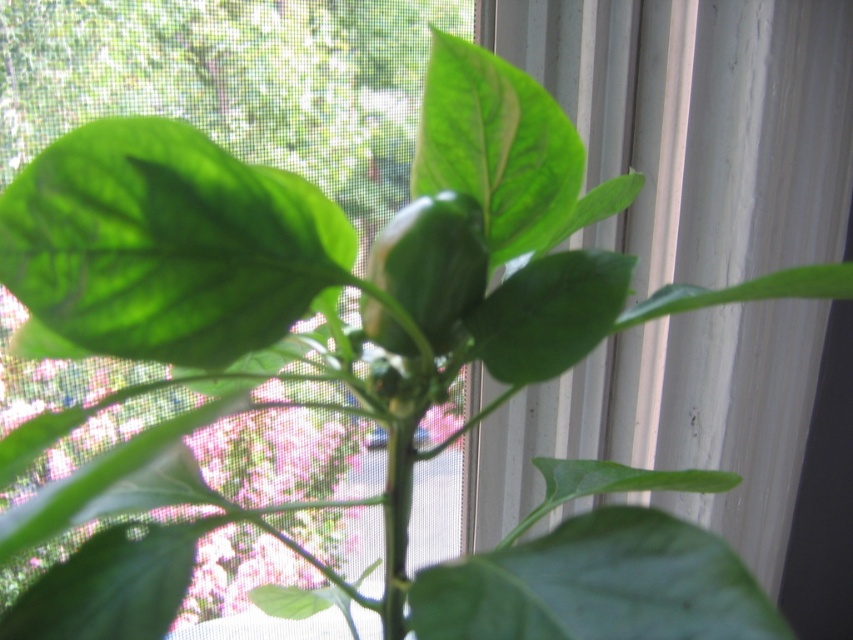
You are a gardener who needs to measure the space between two leaves on a pepper plant. You have a ruler that can measure up to 2 inches. Can you accurately measure the gap between the green matte leaf at upper center and the green matte leaf at center?

The gap between the green matte leaf at upper center and the green matte leaf at center is 2.32 inches, which exceeds the ruler length of 2 inches. Therefore, the ruler cannot accurately measure the entire distance between them.

You are a botanist examining the green pepper plant. You need to locate the green matte leaf at upper center. Where is it positioned in the image?

The green matte leaf at upper center is located at point [496,145].